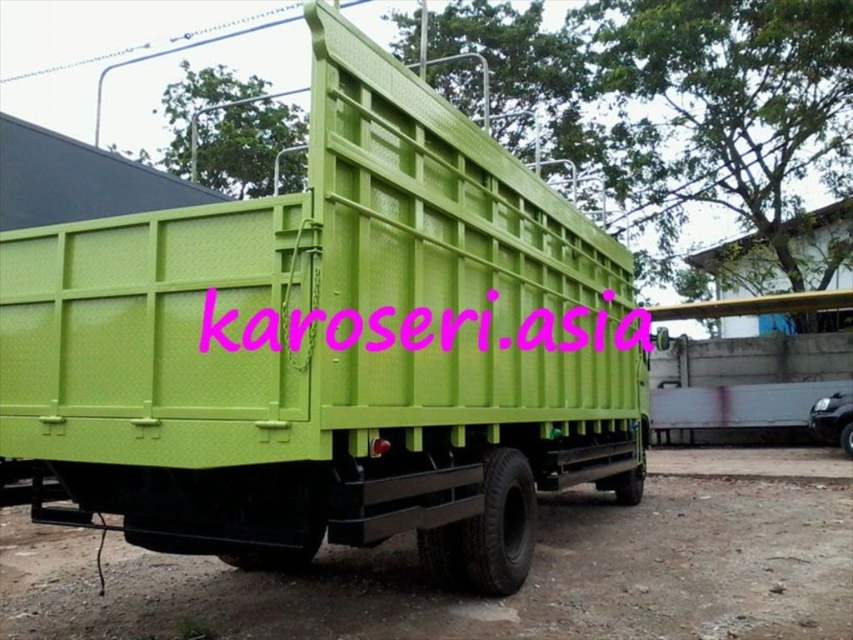
Question: Can you confirm if lime green plastic truck at center is smaller than pink text at center?

Choices:
 (A) yes
 (B) no

Answer: (B)

Question: From the image, what is the correct spatial relationship of lime green plastic truck at center in relation to pink text at center?

Choices:
 (A) left
 (B) right

Answer: (A)

Question: Observing the image, what is the correct spatial positioning of lime green plastic truck at center in reference to pink text at center?

Choices:
 (A) left
 (B) right

Answer: (A)

Question: Which of the following is the closest to the observer?

Choices:
 (A) (326, 324)
 (B) (349, 228)

Answer: (A)

Question: Which point appears farthest from the camera in this image?

Choices:
 (A) (492, 296)
 (B) (489, 289)

Answer: (A)

Question: Among these objects, which one is nearest to the camera?

Choices:
 (A) lime green plastic truck at center
 (B) pink text at center

Answer: (A)